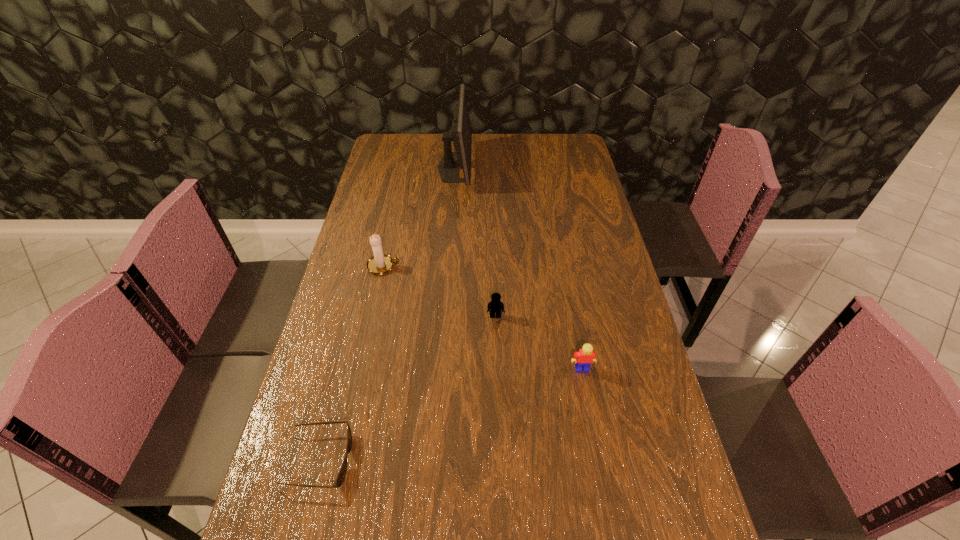
This screenshot has height=540, width=960. I want to click on free space between the computer monitor and the shortest object, so click(x=386, y=314).

Where is `vacant area that lies between the shortest object and the tallest object`? The image size is (960, 540). vacant area that lies between the shortest object and the tallest object is located at coordinates (386, 314).

This screenshot has width=960, height=540. Find the location of `empty space between the sunglasses and the tallest object`. empty space between the sunglasses and the tallest object is located at coordinates (386, 314).

Locate which object is the closest to the shorter Lego. Please provide its 2D coordinates. Your answer should be formatted as a tuple, i.e. [(x, y)], where the tuple contains the x and y coordinates of a point satisfying the conditions above.

[(584, 358)]

Where is `object that is the third closest one to the nearest object`? The width and height of the screenshot is (960, 540). object that is the third closest one to the nearest object is located at coordinates (584, 358).

Where is `vacant space that satisfies the following two spatial constraints: 1. on the front-facing side of the second nearest object; 2. on the lenses of the shortest object`? vacant space that satisfies the following two spatial constraints: 1. on the front-facing side of the second nearest object; 2. on the lenses of the shortest object is located at coordinates (599, 460).

Where is `vacant space that satisfies the following two spatial constraints: 1. on the front-facing side of the second shortest object; 2. on the lenses of the shortest object`? vacant space that satisfies the following two spatial constraints: 1. on the front-facing side of the second shortest object; 2. on the lenses of the shortest object is located at coordinates (500, 460).